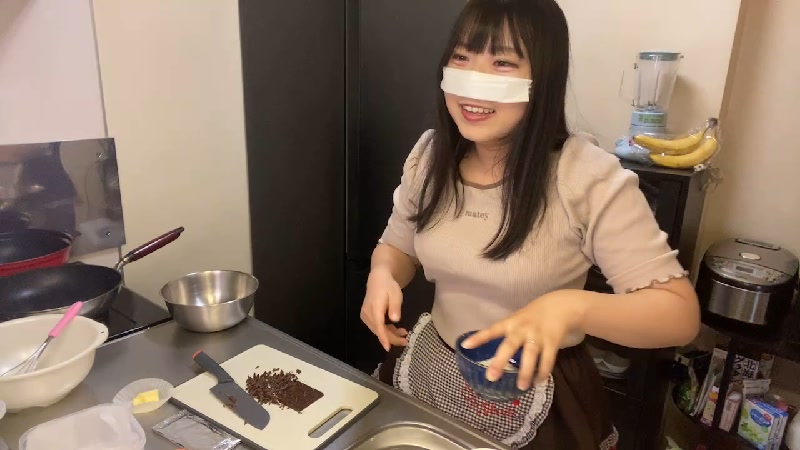
At what (x,y) coordinates should I click in order to perform the action: click on blender. Please return your answer as a coordinate pair (x, y). The width and height of the screenshot is (800, 450). Looking at the image, I should click on (646, 87).